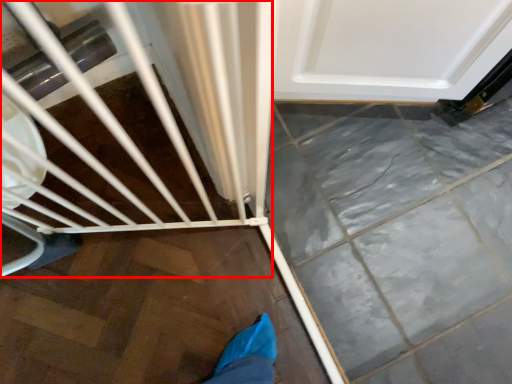
Question: Considering the relative positions of baby carriage (annotated by the red box) and door in the image provided, where is baby carriage (annotated by the red box) located with respect to the staircase?

Choices:
 (A) right
 (B) left

Answer: (B)